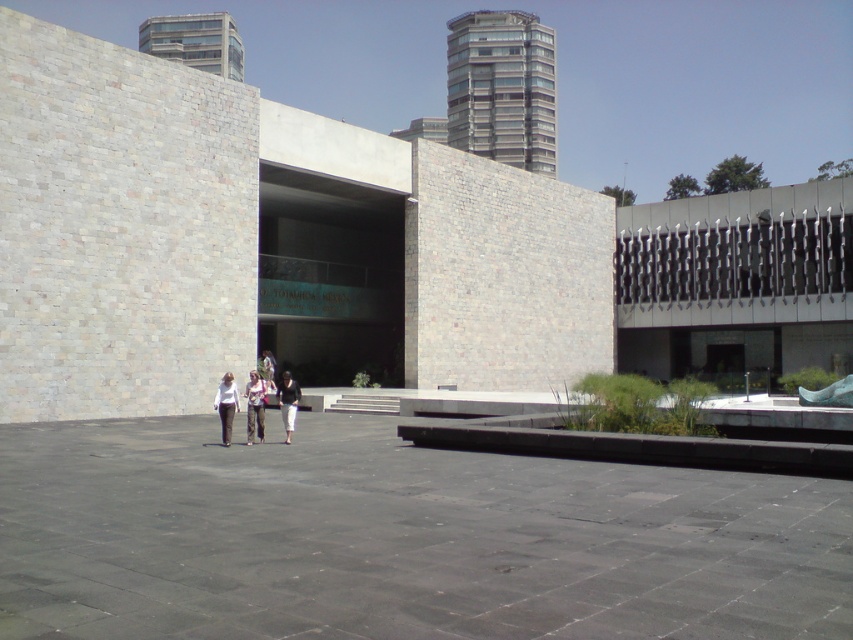
Does light brown pants at center have a larger size compared to white matte pants at center?

No, light brown pants at center is not bigger than white matte pants at center.

Can you confirm if light brown pants at center is smaller than white matte pants at center?

Yes.

Find the location of a particular element. This screenshot has height=640, width=853. light brown pants at center is located at coordinates (254, 406).

Does black matte pants at center appear on the right side of light brown leather jacket at center?

Indeed, black matte pants at center is positioned on the right side of light brown leather jacket at center.

Locate an element on the screen. The width and height of the screenshot is (853, 640). black matte pants at center is located at coordinates (287, 403).

Between point (292, 385) and point (260, 371), which one is positioned in front?

Point (292, 385) is more forward.

Where is `black matte pants at center`? Image resolution: width=853 pixels, height=640 pixels. black matte pants at center is located at coordinates (287, 403).

Looking at this image, measure the distance between black concrete courtyard at center and camera.

4.77 meters

Image resolution: width=853 pixels, height=640 pixels. I want to click on black concrete courtyard at center, so click(x=399, y=540).

The height and width of the screenshot is (640, 853). I want to click on black concrete courtyard at center, so click(399, 540).